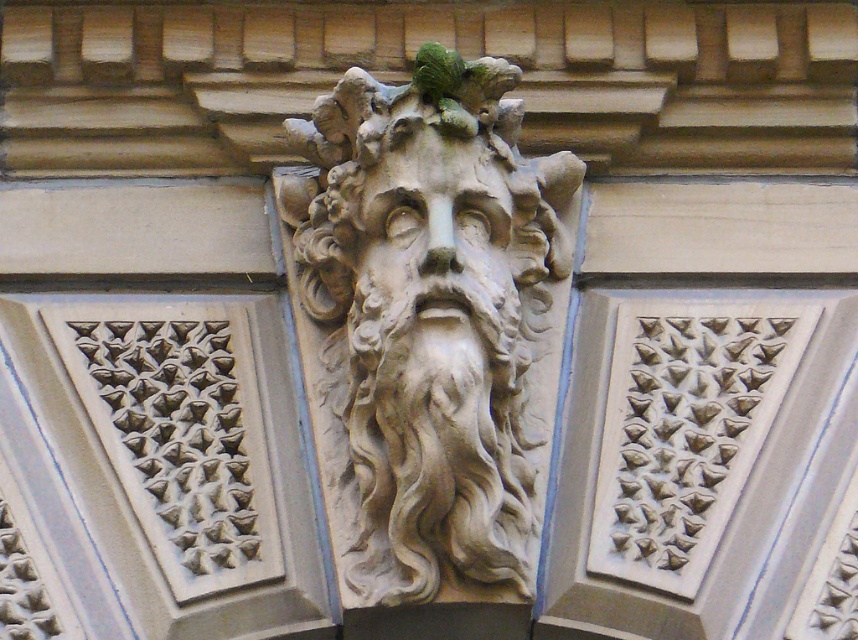
Question: Among these points, which one is farthest from the camera?

Choices:
 (A) coord(505,305)
 (B) coord(361,438)

Answer: (A)

Question: Is stone sculpture at center further to camera compared to stone textured face at center?

Choices:
 (A) no
 (B) yes

Answer: (A)

Question: Which object appears closest to the camera in this image?

Choices:
 (A) stone sculpture at center
 (B) stone textured face at center

Answer: (A)

Question: Is stone sculpture at center below stone textured face at center?

Choices:
 (A) no
 (B) yes

Answer: (A)

Question: Is stone sculpture at center below stone textured face at center?

Choices:
 (A) no
 (B) yes

Answer: (A)